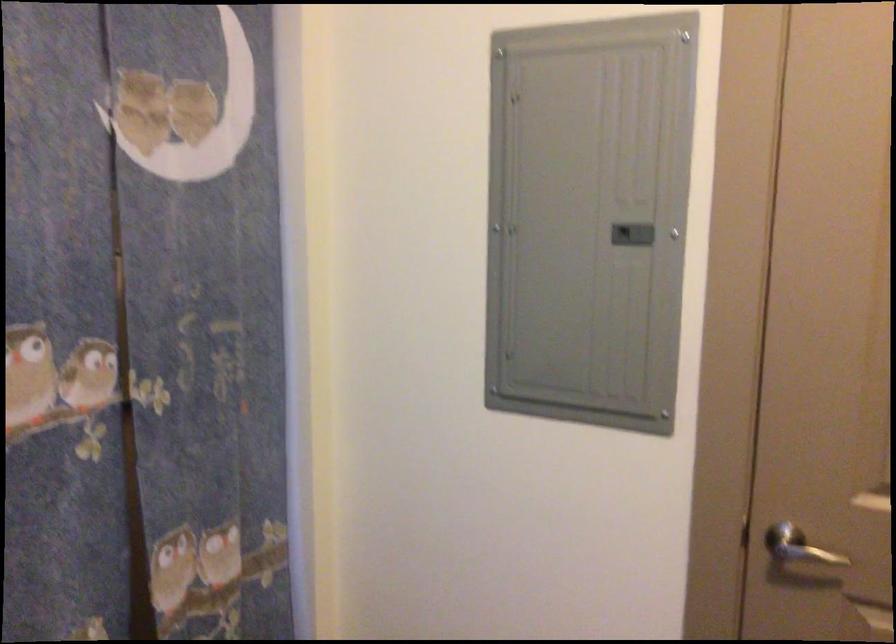
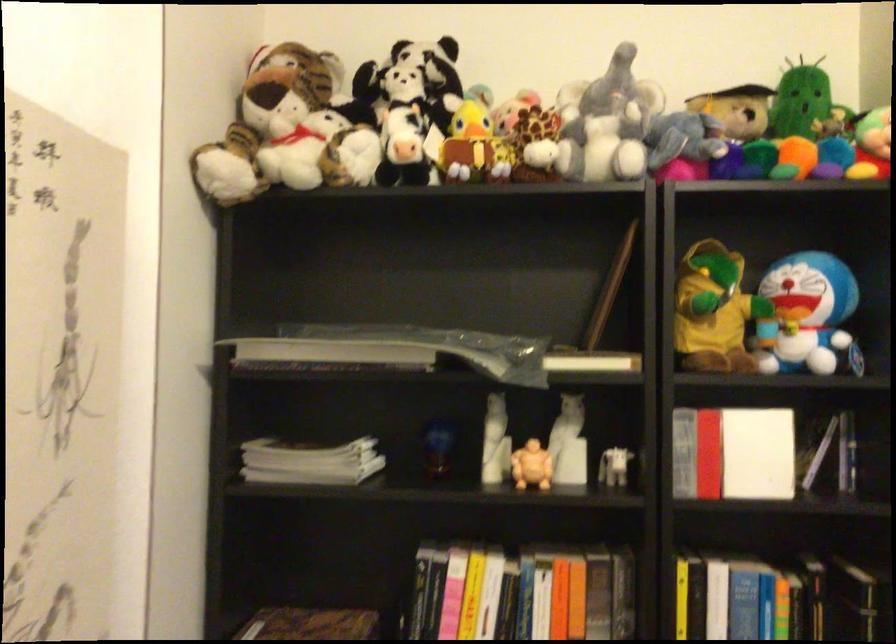
Question: How did the camera likely rotate?

Choices:
 (A) Left
 (B) Right
 (C) Up
 (D) Down

Answer: (B)